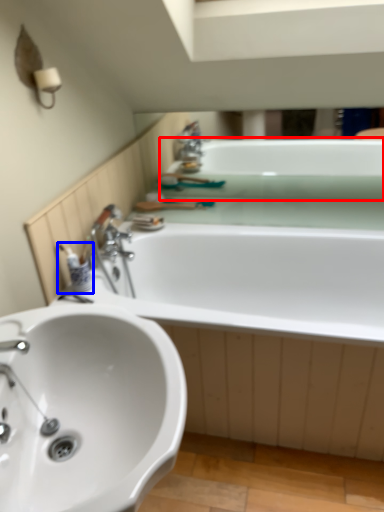
Question: Among these objects, which one is farthest to the camera, bath (highlighted by a red box) or toiletry (highlighted by a blue box)?

Choices:
 (A) bath
 (B) toiletry

Answer: (A)